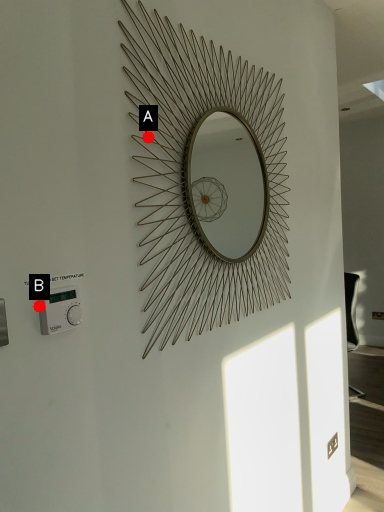
Question: Two points are circled on the image, labeled by A and B beside each circle. Which point appears closest to the camera in this image?

Choices:
 (A) A is closer
 (B) B is closer

Answer: (B)